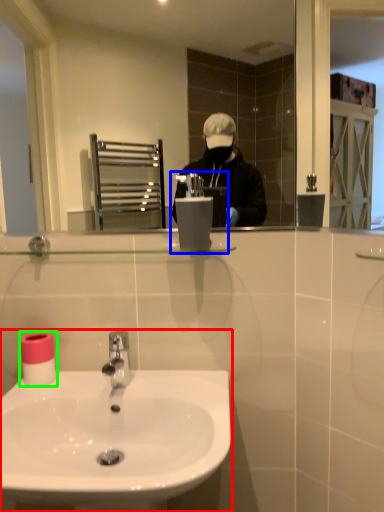
Question: Which object is positioned farthest from sink (highlighted by a red box)? Select from hand dryer (highlighted by a blue box) and toilet paper (highlighted by a green box).

Choices:
 (A) hand dryer
 (B) toilet paper

Answer: (A)